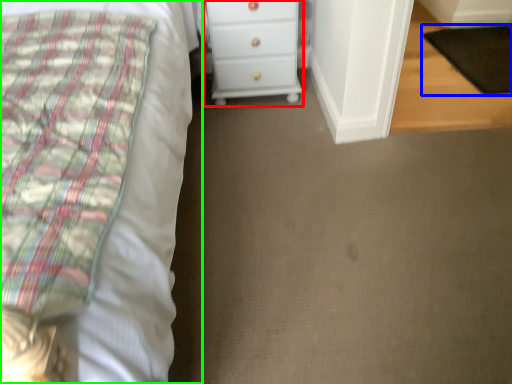
Question: Which object is positioned closest to chest of drawers (highlighted by a red box)? Select from pad (highlighted by a blue box) and bed (highlighted by a green box).

Choices:
 (A) pad
 (B) bed

Answer: (B)